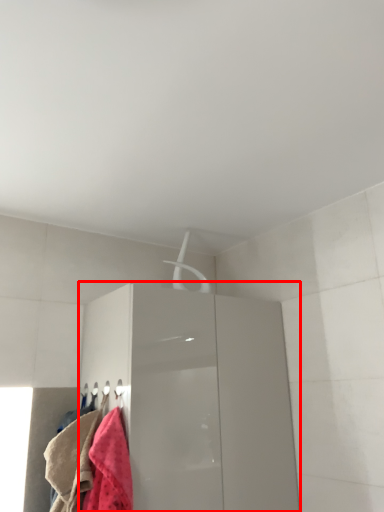
Question: Observing the image, what is the correct spatial positioning of cabinetry (annotated by the red box) in reference to towel?

Choices:
 (A) right
 (B) left

Answer: (A)